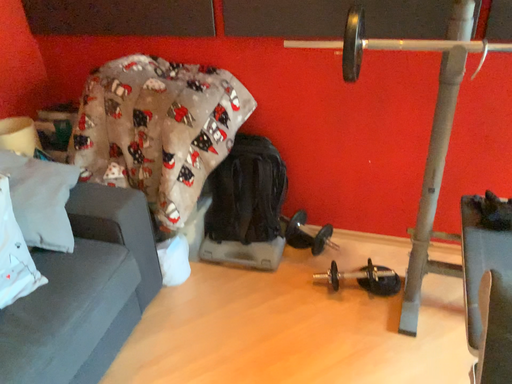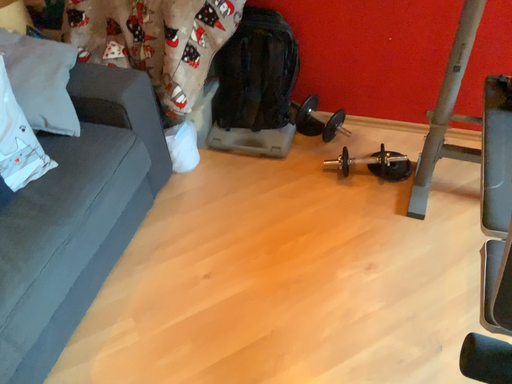
Question: Which way did the camera rotate in the video?

Choices:
 (A) rotated downward
 (B) rotated upward

Answer: (A)